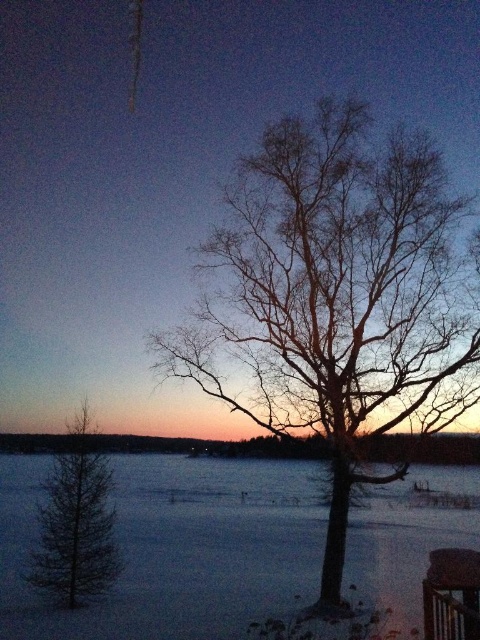
Can you confirm if bare branches at center is wider than dark green coniferous tree at lower left?

Yes, bare branches at center is wider than dark green coniferous tree at lower left.

From the picture: Who is more distant from viewer, (x=257, y=268) or (x=75, y=605)?

The point (x=257, y=268) is more distant.

Where is `bare branches at center`? The width and height of the screenshot is (480, 640). bare branches at center is located at coordinates (336, 296).

Is snowy white water at lower left further to the viewer compared to dark green coniferous tree at lower left?

No, it is in front of dark green coniferous tree at lower left.

Does snowy white water at lower left have a greater width compared to dark green coniferous tree at lower left?

Yes.

Is point (120, 602) positioned behind point (70, 529)?

No.

Locate an element on the screen. This screenshot has height=640, width=480. snowy white water at lower left is located at coordinates (176, 548).

Can you confirm if bare branches at center is positioned to the right of snowy white water at lower left?

Correct, you'll find bare branches at center to the right of snowy white water at lower left.

Find the location of `bare branches at center`. bare branches at center is located at coordinates (336, 296).

This screenshot has height=640, width=480. I want to click on bare branches at center, so click(336, 296).